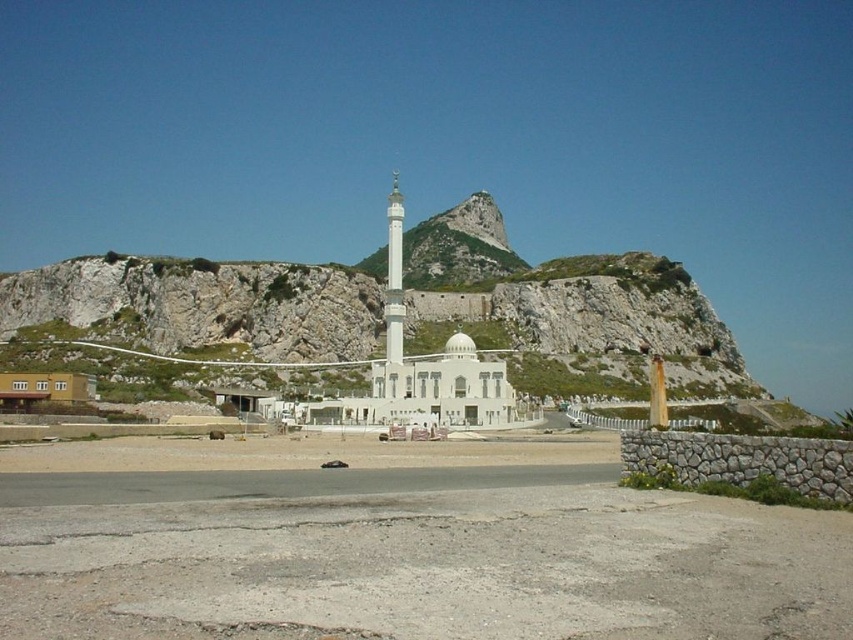
You are standing in front of the gray stone wall at lower right and want to reach the white mosque situated at the base of the rugged, rocky hill. If the distance between you and the mosque is 50 meters, can you see the top of the mosque from your current position?

The gray stone wall at lower right is 40.68 meters away from the viewer. Since the mosque is 50 meters away, it is beyond the wall. The wall is at the lower right, so unless it blocks the line of sight, you might still see the top of the mosque. However, the description doesn not specify the wall height or the mosque height, so we can not confirm visibility.

You are standing in front of the mosque and want to take a photo of the white marble minaret at center. To avoid including the gray stone wall at lower right in your photo, should you move forward or backward?

The gray stone wall at lower right is located below the white marble minaret at center. To avoid including the gray stone wall at lower right in your photo, you should move backward to frame the white marble minaret at center without the wall in the foreground.

You are standing at the edge of the gray stone wall at lower right and want to take a photo of the white marble minaret at center. Since the wall is in your way, can you move to the left or right to get a clear view of the minaret?

The gray stone wall at lower right is in front of the white marble minaret at center. To get a clear view, you should move to the left side of the wall so that the minaret becomes visible beyond the wall.